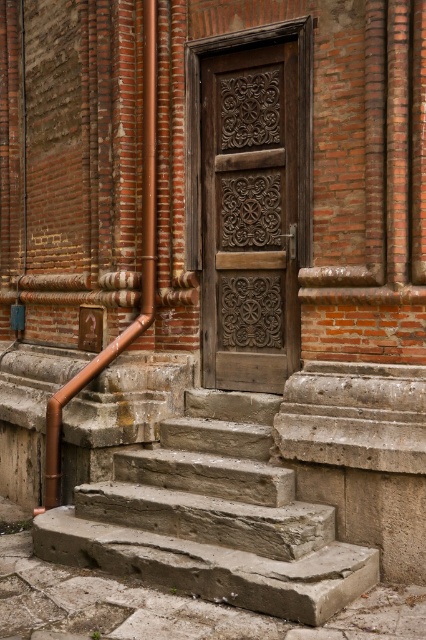
Find the location of `gray stone stairs at center`. gray stone stairs at center is located at coordinates (212, 518).

Is gray stone stairs at center to the right of copper pipe at left from the viewer's perspective?

Indeed, gray stone stairs at center is positioned on the right side of copper pipe at left.

Does point (319, 541) lie behind point (97, 369)?

No, it is not.

Locate an element on the screen. This screenshot has width=426, height=640. gray stone stairs at center is located at coordinates (212, 518).

How distant is carved wood door at center from copper pipe at left?

carved wood door at center is 30.29 inches from copper pipe at left.

Does carved wood door at center appear on the right side of copper pipe at left?

Yes, carved wood door at center is to the right of copper pipe at left.

Between point (287, 248) and point (54, 432), which one is positioned behind?

Point (54, 432)

Find the location of a particular element. The image size is (426, 640). carved wood door at center is located at coordinates (250, 198).

Is gray stone stairs at center taller than carved wood door at center?

No, gray stone stairs at center is not taller than carved wood door at center.

Identify the location of gray stone stairs at center. (212, 518).

Locate an element on the screen. This screenshot has width=426, height=640. gray stone stairs at center is located at coordinates (212, 518).